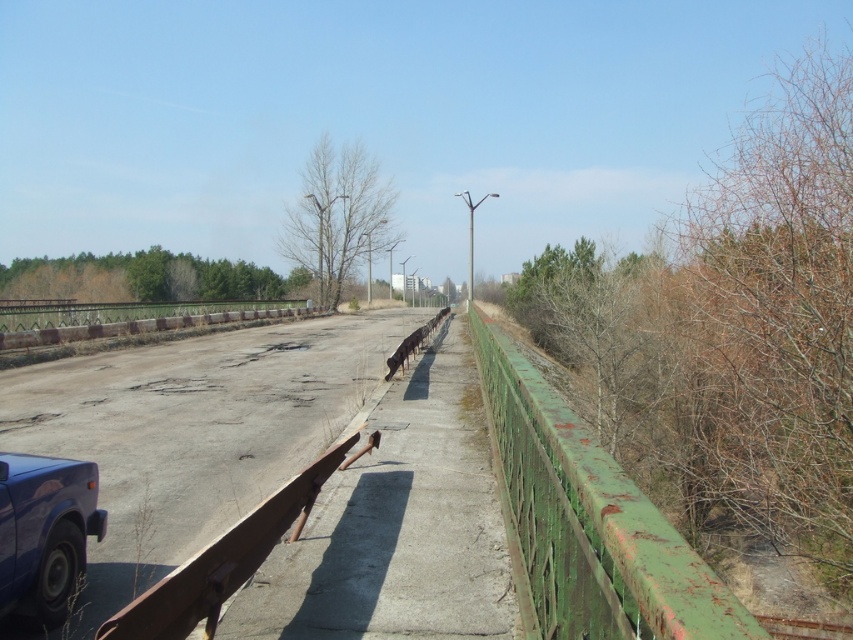
You are driving a delivery van that is 3.5 meters long. You need to pass through the gap between the rusty green fence at right and the matte blue car at lower left. Can your van fit through the gap without touching either the fence or the car?

The gap between the rusty green fence at right and the matte blue car at lower left is 3.60 meters. Since your van is 3.5 meters long, it can fit through the gap as there is enough space.